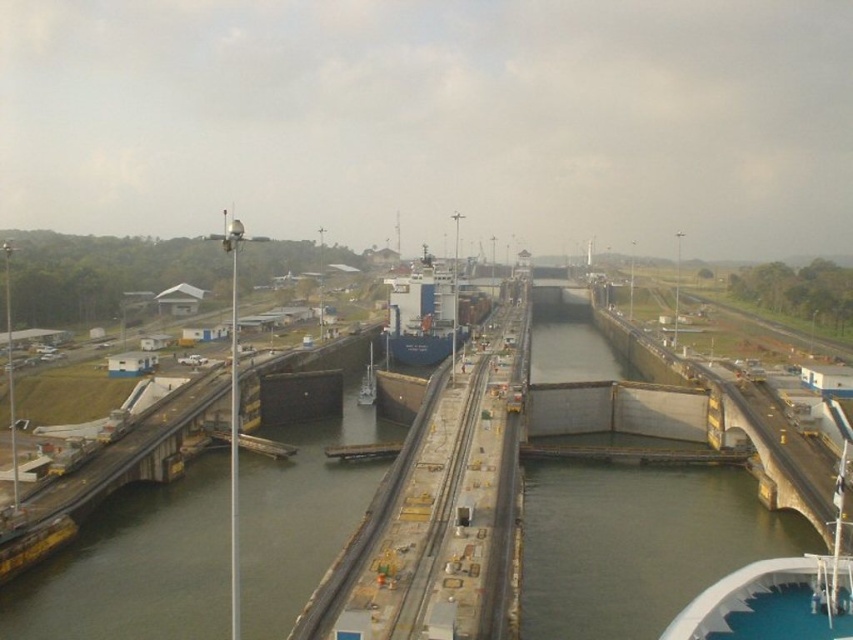
Question: Where is gray concrete lock at center located in relation to blue matte ship at center in the image?

Choices:
 (A) left
 (B) right

Answer: (B)

Question: Is gray concrete lock at center above blue matte ship at center?

Choices:
 (A) no
 (B) yes

Answer: (B)

Question: Which point appears farthest from the camera in this image?

Choices:
 (A) (370, 352)
 (B) (488, 304)

Answer: (B)

Question: Which is nearer to the blue matte container ship at center?

Choices:
 (A) gray concrete lock at center
 (B) blue matte ship at center

Answer: (B)

Question: Can you confirm if blue matte container ship at center is positioned above blue matte ship at center?

Choices:
 (A) no
 (B) yes

Answer: (B)

Question: Which of the following is the closest to the observer?

Choices:
 (A) (367, 376)
 (B) (416, 276)
 (C) (578, 588)

Answer: (C)